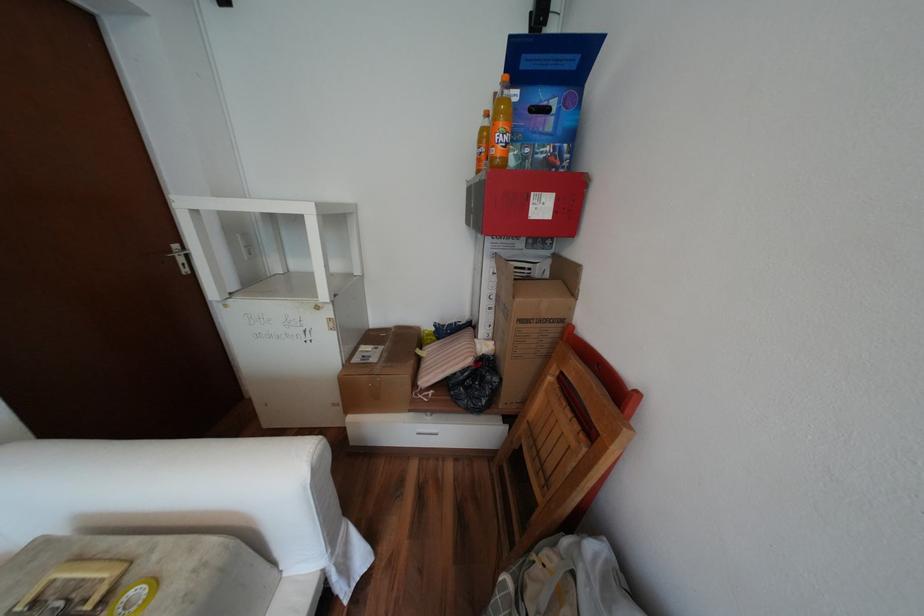
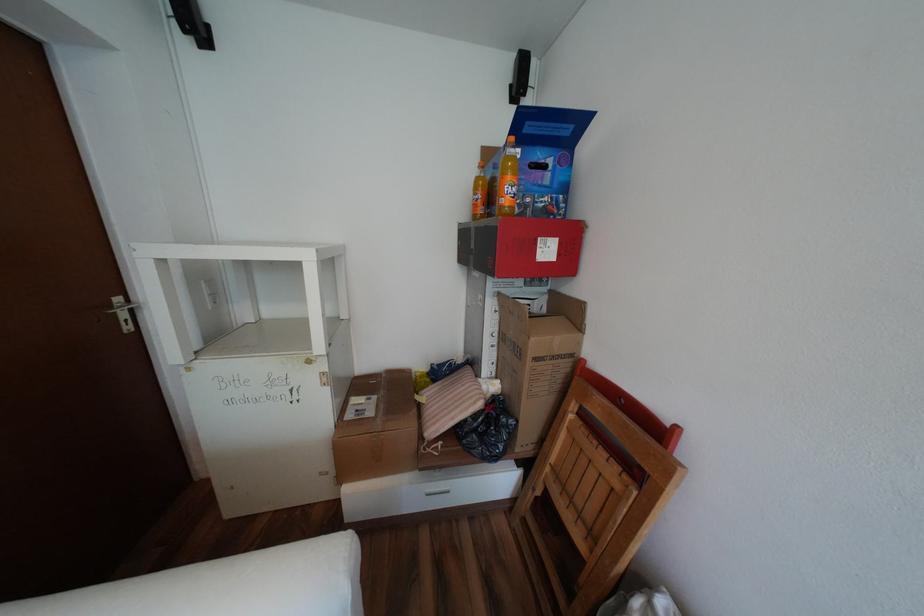
The point at (503, 297) is marked in the first image. Where is the corresponding point in the second image?

(505, 334)